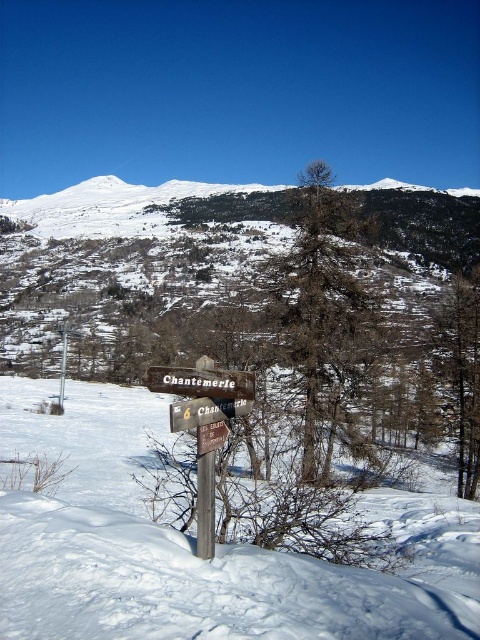
Who is positioned more to the left, wooden sign at center or brown wooden sign at center?

Positioned to the left is brown wooden sign at center.

Find the location of a particular element. The width and height of the screenshot is (480, 640). wooden sign at center is located at coordinates (201, 381).